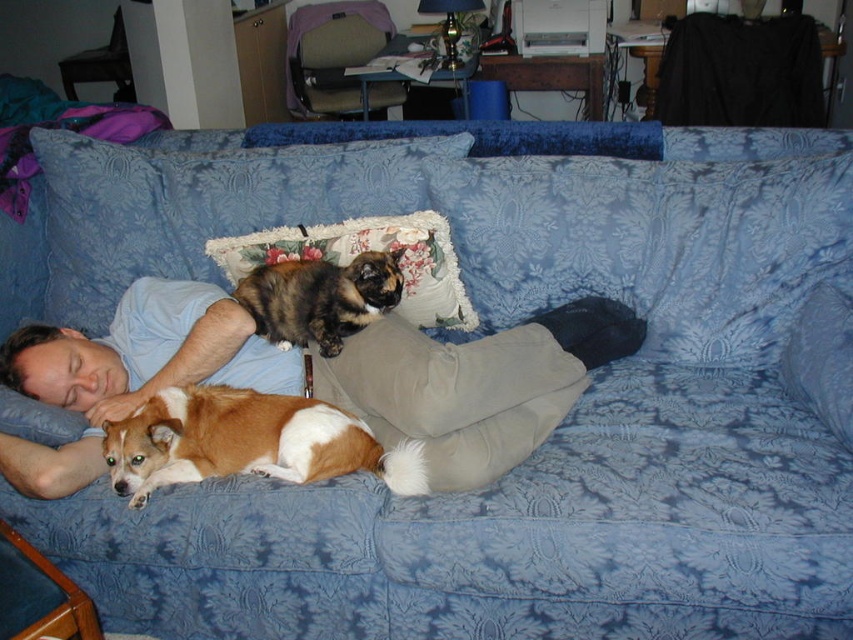
You are a person trying to place a small book on the floral fabric pillow at center. Based on the scene description, can you confirm the exact coordinates where the pillow is located?

The floral fabric pillow at center is located at point (363, 250).

In the scene shown: You are a house guest who just arrived and wants to sit on the sofa. The host mentioned that the brown and white fur at lower left belongs to their pet. Where exactly should you avoid sitting to not disturb the pet?

You should avoid sitting near the area at point [247,442] where the brown and white fur at lower left is located to avoid disturbing the pet.

In the scene shown: You are a guest in this living room and want to sit on the sofa without disturbing the existing items. Which object between the brown and white fur at lower left and the floral fabric pillow at center should you avoid sitting on?

You should avoid sitting on the brown and white fur at lower left because it has a smaller size compared to the floral fabric pillow at center, making it less stable and more likely to be displaced.